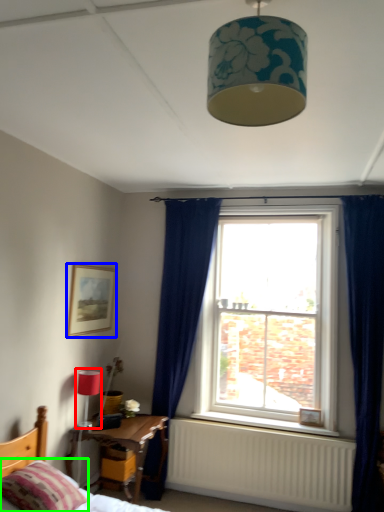
Question: Which object is the closest to the lamp (highlighted by a red box)? Choose among these: picture frame (highlighted by a blue box) or pillow (highlighted by a green box).

Choices:
 (A) picture frame
 (B) pillow

Answer: (A)